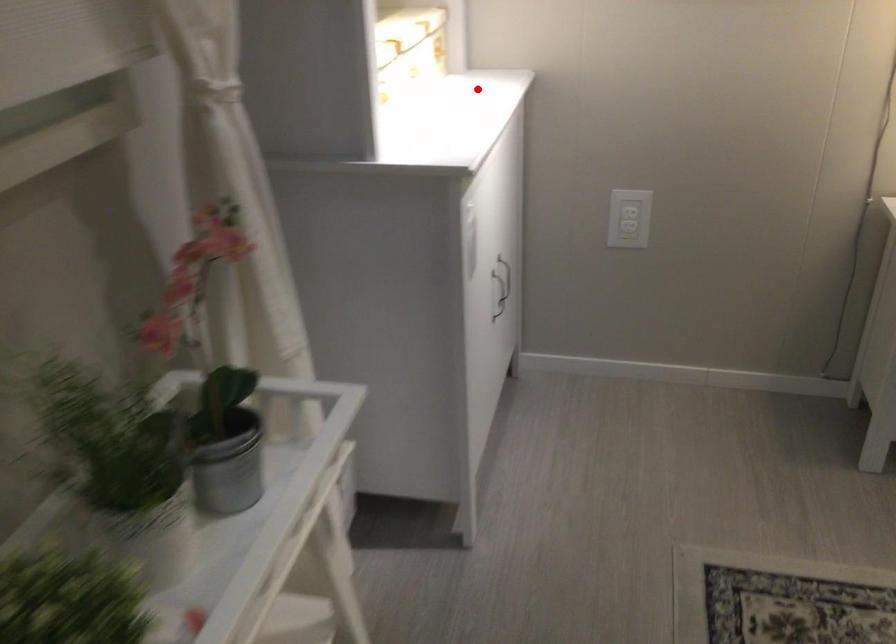
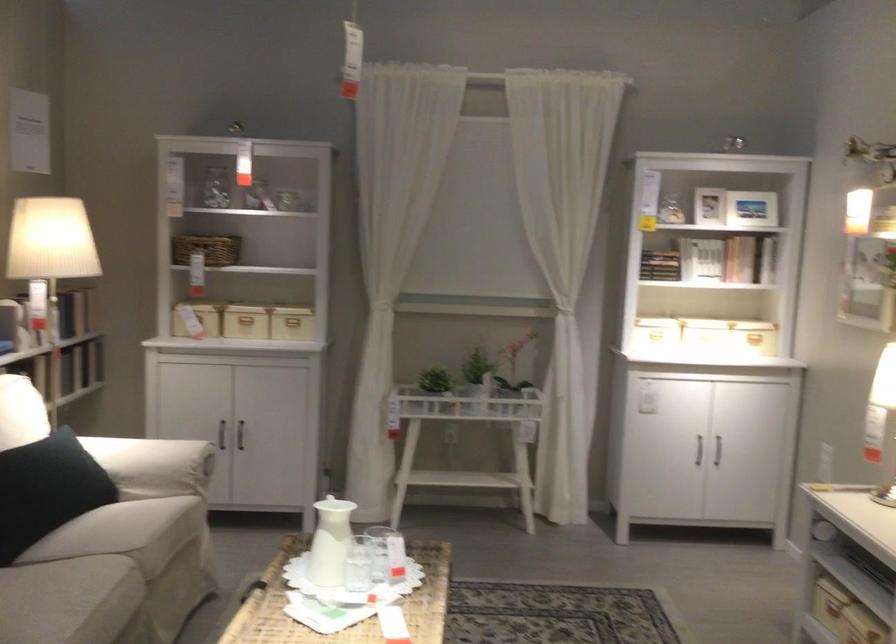
Question: A red point is marked in image1. In image2, is the corresponding 3D point closer to the camera or farther? Reply with the corresponding letter.

Choices:
 (A) The corresponding 3D point is closer.
 (B) The corresponding 3D point is farther.

Answer: (B)